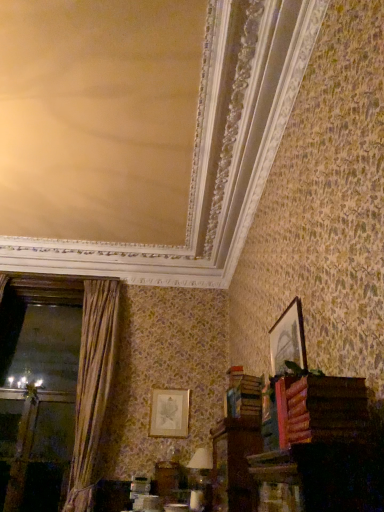
Question: Would you say wooden book at lower right, the second book when ordered from back to front, is part of wooden book at lower right, which ranks as the 1th book in bottom-to-top order,'s contents?

Choices:
 (A) yes
 (B) no

Answer: (B)

Question: From a real-world perspective, is wooden book at lower right, the 2th book from the front, located higher than wooden book at lower right, which is the first book from top to bottom?

Choices:
 (A) no
 (B) yes

Answer: (B)

Question: Does wooden book at lower right, the 2th book from the front, have a larger size compared to wooden book at lower right, which is the first book from top to bottom?

Choices:
 (A) yes
 (B) no

Answer: (A)

Question: Does wooden book at lower right, which is the 1th book from back to front, appear on the right side of wooden book at lower right, which is the first book from top to bottom?

Choices:
 (A) yes
 (B) no

Answer: (B)

Question: Considering the relative sizes of wooden book at lower right, which ranks as the 1th book in bottom-to-top order, and wooden book at lower right, which ranks as the 1th book in front-to-back order, in the image provided, is wooden book at lower right, which ranks as the 1th book in bottom-to-top order, wider than wooden book at lower right, which ranks as the 1th book in front-to-back order,?

Choices:
 (A) yes
 (B) no

Answer: (B)

Question: Relative to wooden book at lower right, the second book when ordered from back to front, is matte silver picture frame at center, which is the second picture frame in top-to-bottom order, in front or behind?

Choices:
 (A) front
 (B) behind

Answer: (B)

Question: Is point (185, 435) positioned closer to the camera than point (357, 400)?

Choices:
 (A) farther
 (B) closer

Answer: (A)

Question: From a real-world perspective, is matte silver picture frame at center, which is the second picture frame in top-to-bottom order, physically located above or below wooden book at lower right, which is the first book from top to bottom?

Choices:
 (A) below
 (B) above

Answer: (B)

Question: Would you say matte silver picture frame at center, the 2th picture frame positioned from the front, is to the left or to the right of wooden book at lower right, which ranks as the 1th book in front-to-back order, in the picture?

Choices:
 (A) left
 (B) right

Answer: (A)

Question: Considering the positions of wooden book at lower right, which ranks as the 1th book in front-to-back order, and wooden book at lower right, which ranks as the 1th book in bottom-to-top order, in the image, is wooden book at lower right, which ranks as the 1th book in front-to-back order, taller or shorter than wooden book at lower right, which ranks as the 1th book in bottom-to-top order,?

Choices:
 (A) tall
 (B) short

Answer: (B)

Question: From the image's perspective, relative to wooden book at lower right, which is the second book in top-to-bottom order, is wooden book at lower right, which is the first book from top to bottom, above or below?

Choices:
 (A) above
 (B) below

Answer: (A)

Question: Is wooden book at lower right, which is the first book from top to bottom, wider or thinner than wooden book at lower right, which is the 1th book from back to front?

Choices:
 (A) wide
 (B) thin

Answer: (A)

Question: In the image, is wooden book at lower right, which ranks as the 1th book in front-to-back order, positioned in front of or behind wooden book at lower right, which ranks as the 1th book in bottom-to-top order?

Choices:
 (A) front
 (B) behind

Answer: (A)

Question: In terms of size, does white paper at lower center appear bigger or smaller than wooden book at lower right, the 2th book from the front?

Choices:
 (A) small
 (B) big

Answer: (B)

Question: Considering their positions, is white paper at lower center located in front of or behind wooden book at lower right, which is the 1th book from back to front?

Choices:
 (A) front
 (B) behind

Answer: (B)